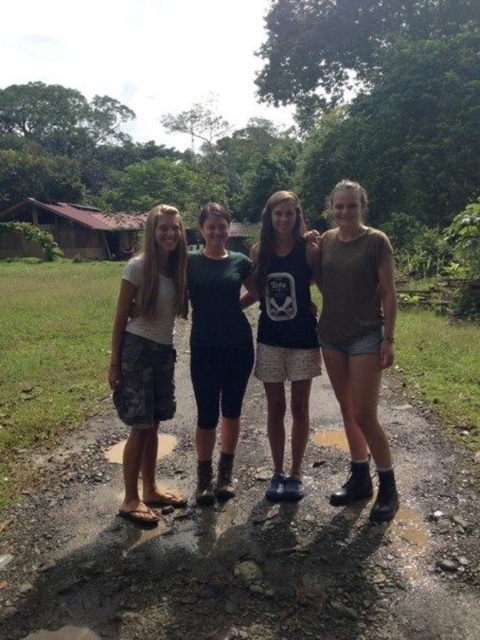
You are a tour guide leading a group on a gravel path in a tropical area. You notice a brown dirt track at center and camo shorts at left. Can you safely walk between them with a 1.2 meter wide tour cart?

The distance between the brown dirt track at center and camo shorts at left is 1.15 meters, which is narrower than the 1.2 meter width of the tour cart. Therefore, the cart cannot safely pass through this space.

You are a photographer trying to capture a group photo of the brown denim shorts at lower right and the black matte tank top at center. Which of the two should you focus on first if you want to ensure they are both in sharp focus?

The brown denim shorts at lower right is much taller than the black matte tank top at center, so focusing on the taller object first would help ensure both are in sharp focus.